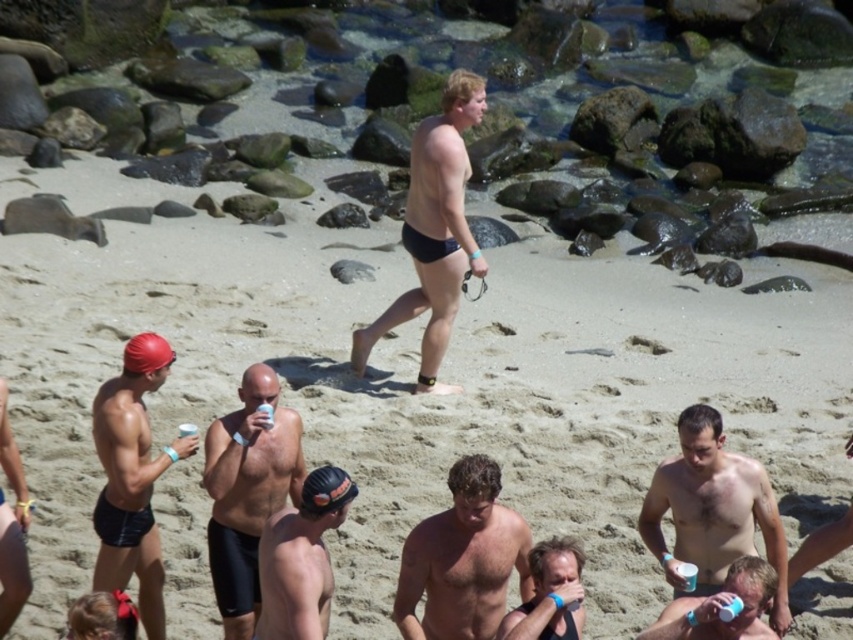
You are a photographer at the beach event and want to capture both the black matte swim cap at center and the smooth skin man at center in a single shot. However, your camera has a limited zoom range. Based on their sizes, which object should you focus on first to ensure both are in frame?

The black matte swim cap at center is larger in size than the smooth skin man at center, so you should focus on the black matte swim cap at center first to ensure both are in frame.

Based on the scene description, what is the 2D coordinate of the clear water at center?

The clear water at center is located at the 2D coordinate point of (x=595, y=163).